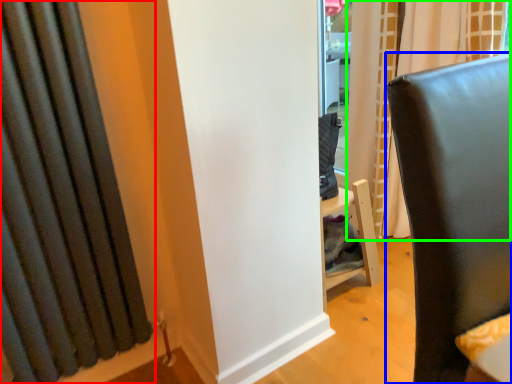
Question: Estimate the real-world distances between objects in this image. Which object is farther from curtain (highlighted by a red box), furniture (highlighted by a blue box) or curtain (highlighted by a green box)?

Choices:
 (A) furniture
 (B) curtain

Answer: (B)